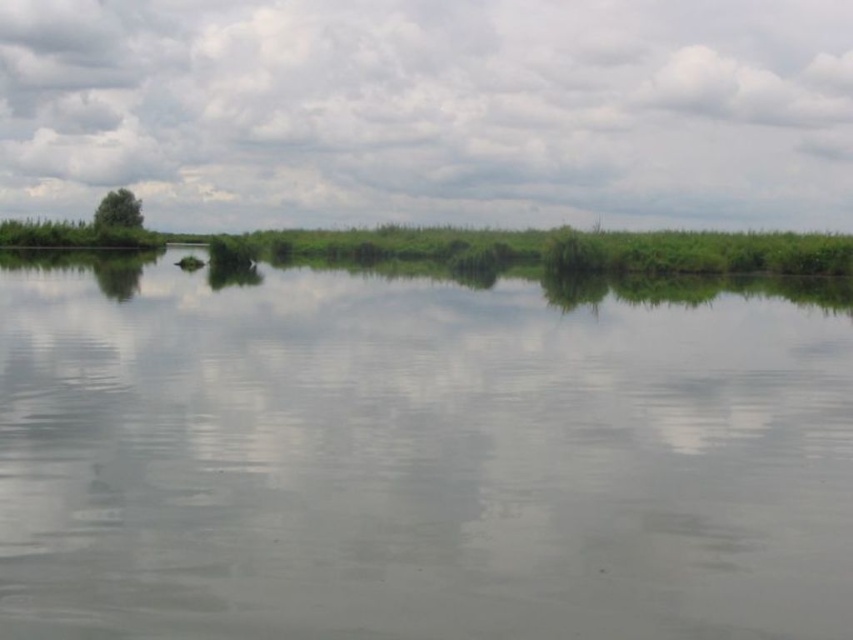
You are an artist planning to paint the scene. You want to ensure the white fluffy cloud at upper center and the green leafy tree at upper left are proportionally accurate. Which object should you make wider in your painting?

The white fluffy cloud at upper center should be made wider in the painting since its width surpasses that of the green leafy tree at upper left according to the description.

You are standing on the bank of the water body and want to determine which object in the scene is taller between the green grassy river at center and the green leafy tree at upper left. Based on the description, which one is taller?

The green grassy river at center is taller than the green leafy tree at upper left according to the description.

You are standing on the lakeshore and notice a white fluffy cloud at upper center and a green leafy tree at upper left in the sky. Which object is closer to you?

The white fluffy cloud at upper center is closer to you than the green leafy tree at upper left.